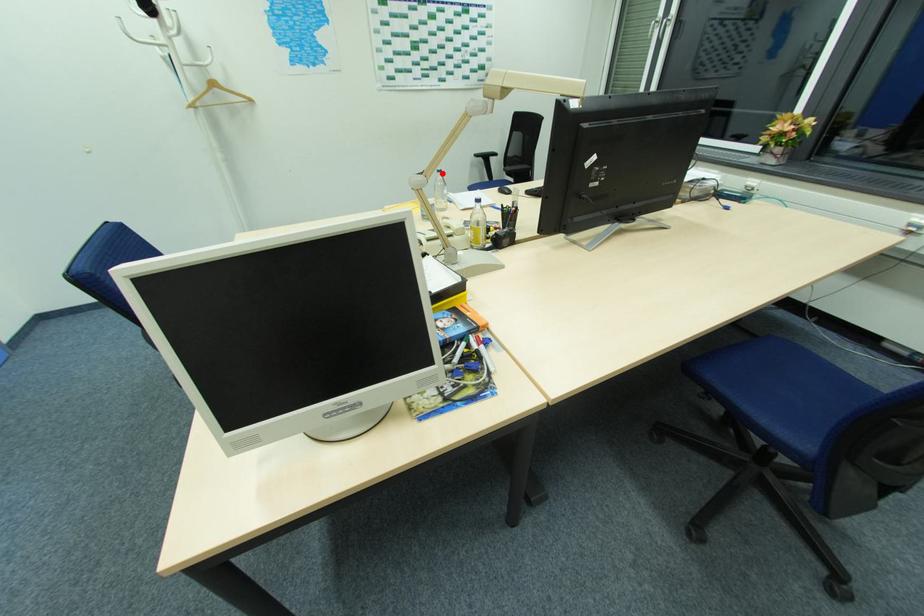
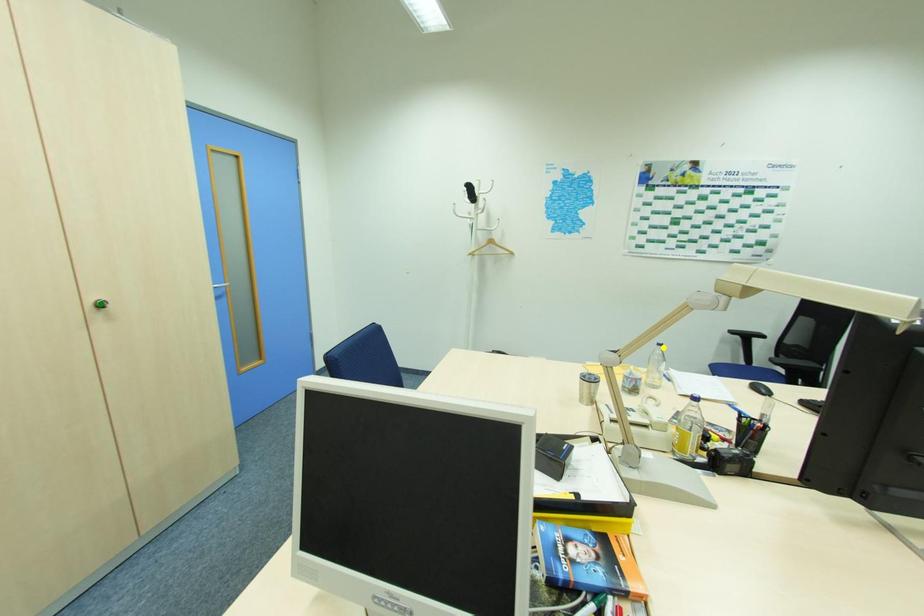
Question: I am providing you with two images of the same scene from different viewpoints. A red point is marked on the first image. You are given multiple points on the second image. Which mark in image 2 goes with the point in image 1?

Choices:
 (A) blue point
 (B) green point
 (C) yellow point

Answer: (C)